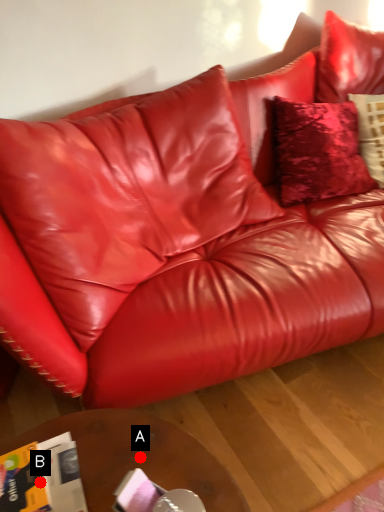
Question: Two points are circled on the image, labeled by A and B beside each circle. Which point appears farthest from the camera in this image?

Choices:
 (A) A is further
 (B) B is further

Answer: (A)